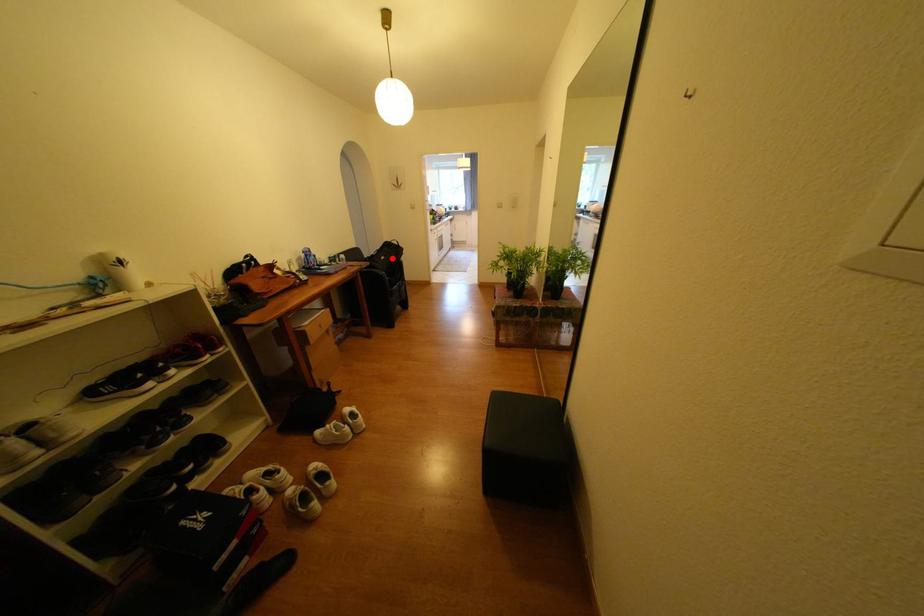
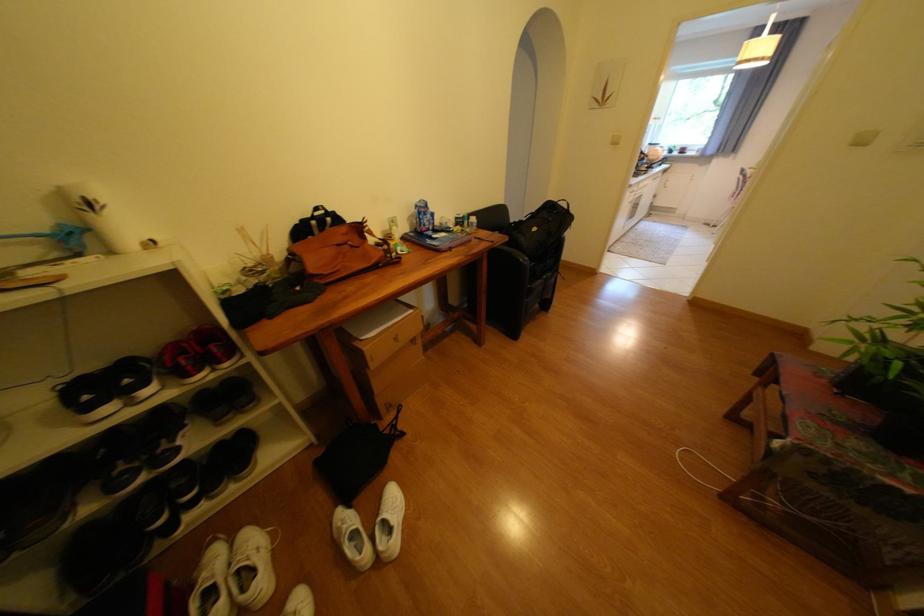
Locate, in the second image, the point that corresponds to the highlighted location in the first image.

(543, 230)